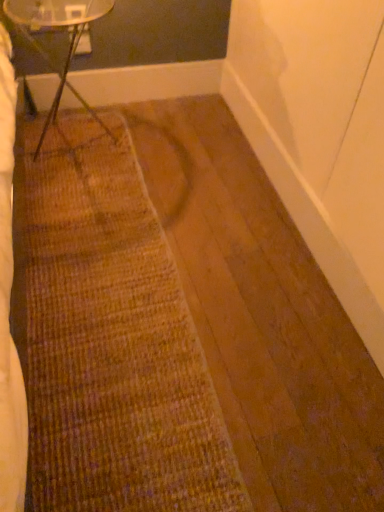
Question: Would you say brown textured mat at center is inside or outside clear glass table at upper left?

Choices:
 (A) outside
 (B) inside

Answer: (A)

Question: Considering their positions, is brown textured mat at center located in front of or behind clear glass table at upper left?

Choices:
 (A) front
 (B) behind

Answer: (A)

Question: Considering the positions of point (104, 266) and point (13, 1), is point (104, 266) closer or farther from the camera than point (13, 1)?

Choices:
 (A) farther
 (B) closer

Answer: (A)

Question: In terms of height, does clear glass table at upper left look taller or shorter compared to brown textured mat at center?

Choices:
 (A) tall
 (B) short

Answer: (A)

Question: From the image's perspective, is clear glass table at upper left above or below brown textured mat at center?

Choices:
 (A) below
 (B) above

Answer: (B)

Question: Is clear glass table at upper left inside or outside of brown textured mat at center?

Choices:
 (A) inside
 (B) outside

Answer: (B)

Question: From a real-world perspective, is clear glass table at upper left positioned above or below brown textured mat at center?

Choices:
 (A) above
 (B) below

Answer: (A)